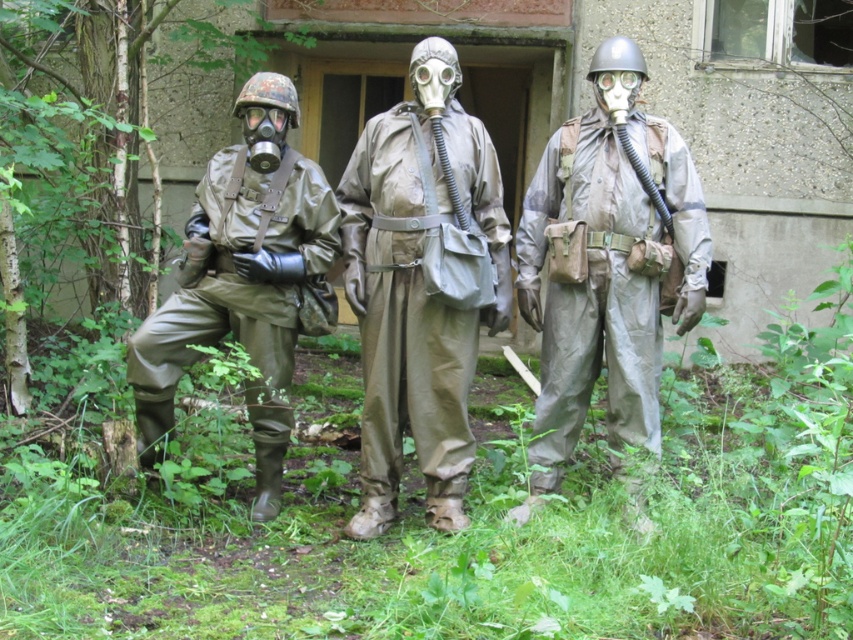
You are an emergency responder assessing the scene. You notice the matte khaki gas mask at center and the matte green rubber suit at left. Which object is covering the other?

The matte khaki gas mask at center is positioned over the matte green rubber suit at left, indicating it is covering the suit.

Based on the photo, you are a safety inspector assessing the scene. You notice the matte khaki gas mask at center and the matte green rubber suit at left. Which object is positioned more to the left?

The matte green rubber suit at left is positioned more to the left than the matte khaki gas mask at center.

You are a safety inspector observing the scene. You notice two individuals wearing protective suits. The first is wearing a matte green rubber suit at left, and the second is wearing a camouflage fabric suit at center. Based on their positions, which suit is positioned to the right of the other?

The camouflage fabric suit at center is positioned to the right of the matte green rubber suit at left.